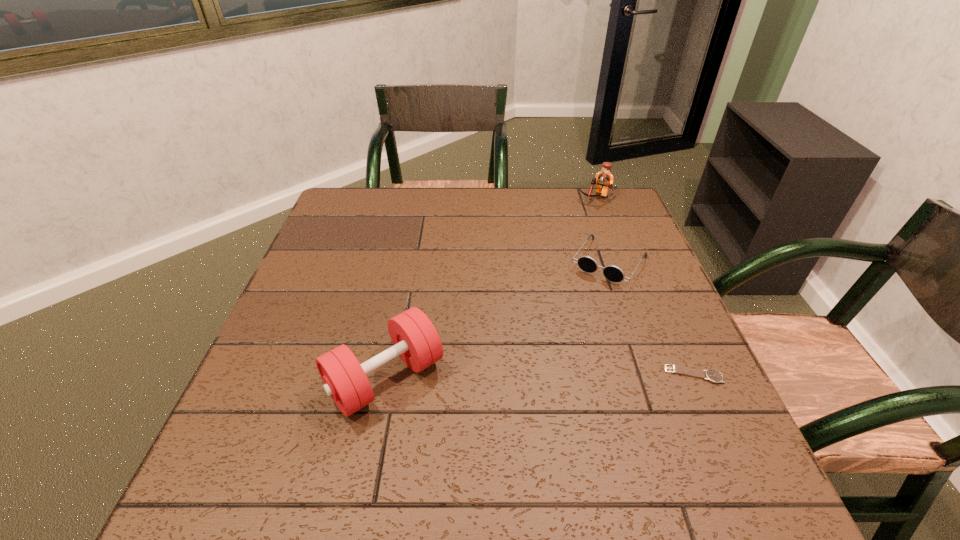
Where is `dumbbell`? This screenshot has width=960, height=540. dumbbell is located at coordinates (415, 339).

The image size is (960, 540). Identify the location of the shortest object. (714, 376).

What are the coordinates of `the second shortest object` in the screenshot? It's located at (613, 273).

This screenshot has height=540, width=960. In order to click on sunglasses in this screenshot , I will do `click(613, 273)`.

This screenshot has height=540, width=960. What are the coordinates of `Lego` in the screenshot? It's located at (604, 179).

Where is `vacant area located 0.330m on the back of the leftmost object`? vacant area located 0.330m on the back of the leftmost object is located at coordinates (411, 245).

Where is `vacant space located 0.050m on the front of the watch`? This screenshot has height=540, width=960. vacant space located 0.050m on the front of the watch is located at coordinates click(x=708, y=407).

The image size is (960, 540). I want to click on free space located 0.170m on the front-facing side of the sunglasses, so click(565, 327).

Where is `free space located 0.130m on the front-facing side of the sunglasses`? This screenshot has height=540, width=960. free space located 0.130m on the front-facing side of the sunglasses is located at coordinates 573,316.

Locate an element on the screen. free space located on the front-facing side of the sunglasses is located at coordinates (575, 313).